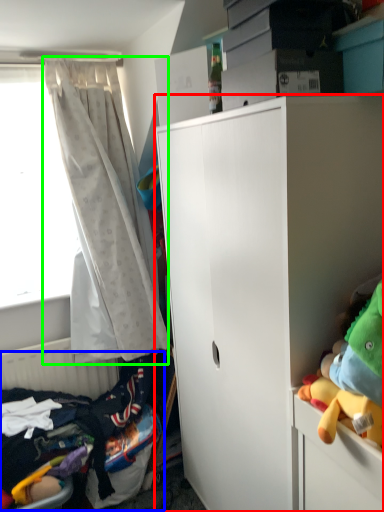
Question: Which object is positioned farthest from cabinetry (highlighted by a red box)? Select from bed (highlighted by a blue box) and curtain (highlighted by a green box).

Choices:
 (A) bed
 (B) curtain

Answer: (A)